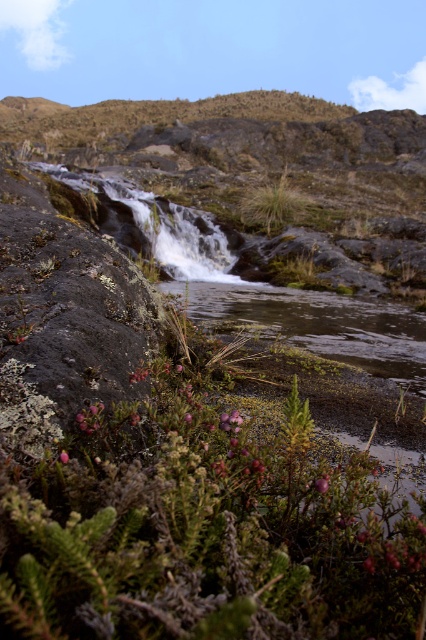
You are a hiker who has just arrived at the waterfall. You notice purple fuzzy berries at bottom center. Based on their position, can you determine if they are near the base of the waterfall or further away from it?

The purple fuzzy berries at bottom center are located at point coordinates suggesting they are near the base of the waterfall since they are positioned at the bottom center of the image, which typically corresponds to the foreground or immediate area around the waterfall.

You are a hiker who wants to pick both the purple fuzzy berries at bottom center and the pink matte flower at center. Which one should you move closer to first if you want to reach them in order from nearest to farthest?

The purple fuzzy berries at bottom center are wider than the pink matte flower at center, so you should move closer to the pink matte flower at center first since it is closer to you.

You are a hiker who wants to cross the shallow pool of water below the waterfall. You see the green grass at center and the pink matte flower at center. Which one is taller and can help you determine the safest path?

The green grass at center is taller than the pink matte flower at center, so the green grass at center might indicate a safer path as taller vegetation often grows in stable ground.